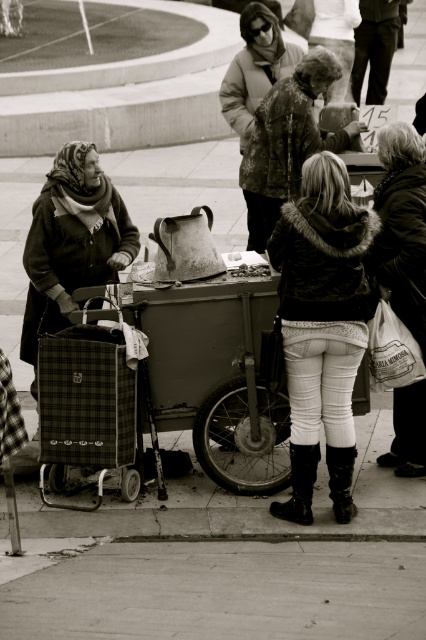
Question: Which point is farther to the camera?

Choices:
 (A) (340, 445)
 (B) (270, 291)
 (C) (417, 276)

Answer: (B)

Question: Does white textured pants at center have a lesser width compared to plaid fabric cart at center?

Choices:
 (A) no
 (B) yes

Answer: (B)

Question: Does white textured pants at center appear on the left side of white textured bag at right?

Choices:
 (A) no
 (B) yes

Answer: (B)

Question: Considering the real-world distances, which object is closest to the white textured bag at right?

Choices:
 (A) plaid fabric cart at center
 (B) white textured pants at center

Answer: (B)

Question: Considering the real-world distances, which object is closest to the white textured pants at center?

Choices:
 (A) white textured bag at right
 (B) plaid fabric cart at center

Answer: (B)

Question: Is white textured pants at center positioned in front of plaid fabric cart at center?

Choices:
 (A) no
 (B) yes

Answer: (B)